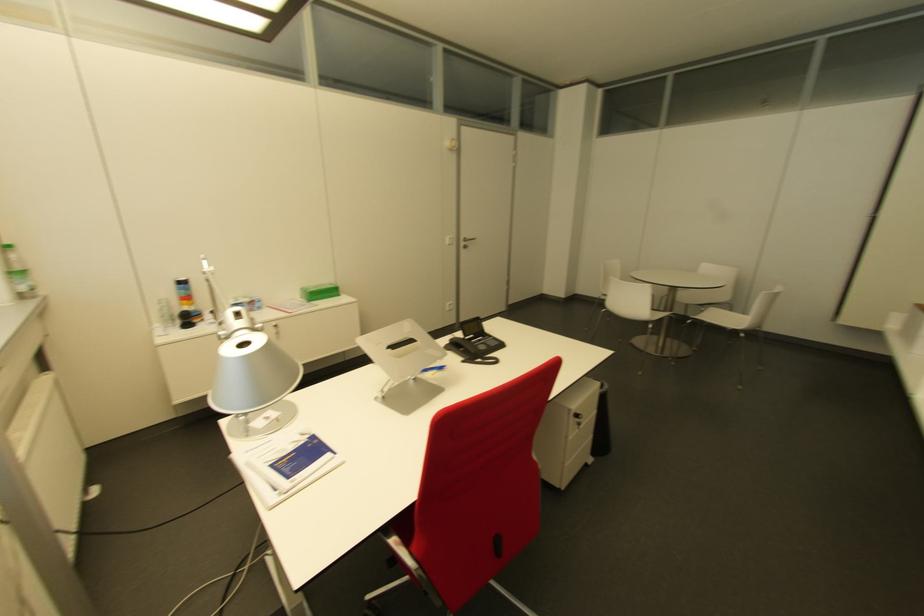
At what (x,y) coordinates should I click in order to perform the action: click on silver door handle. Please return your answer as a coordinate pair (x, y). This screenshot has height=616, width=924. Looking at the image, I should click on (467, 241).